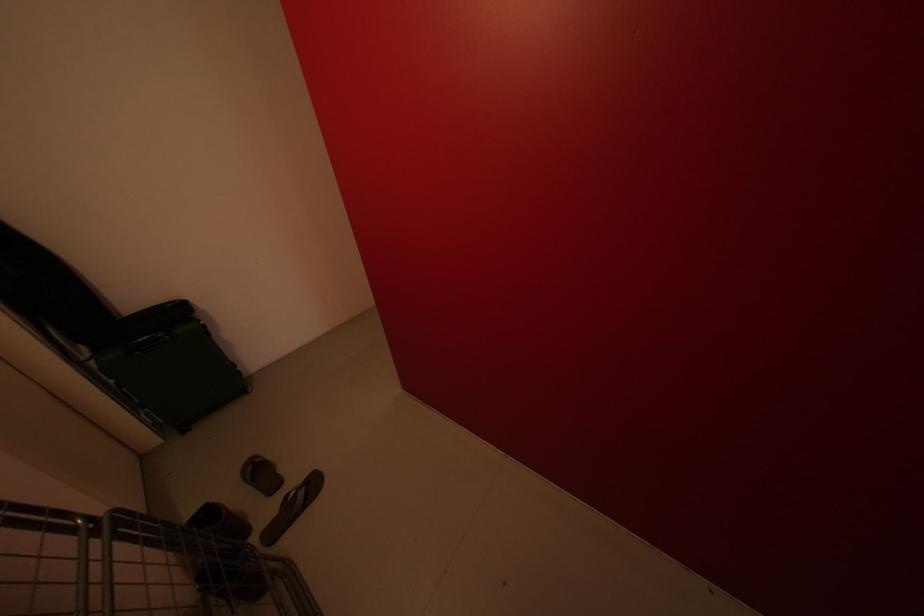
Which object does [261,475] point to?

It corresponds to the dark flip-flop in the image.